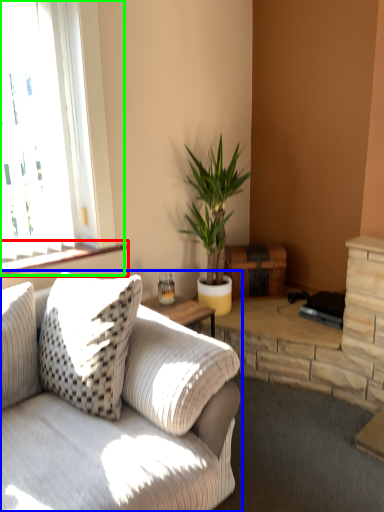
Question: Which object is the farthest from window sill (highlighted by a red box)? Choose among these: studio couch (highlighted by a blue box) or window (highlighted by a green box).

Choices:
 (A) studio couch
 (B) window

Answer: (A)